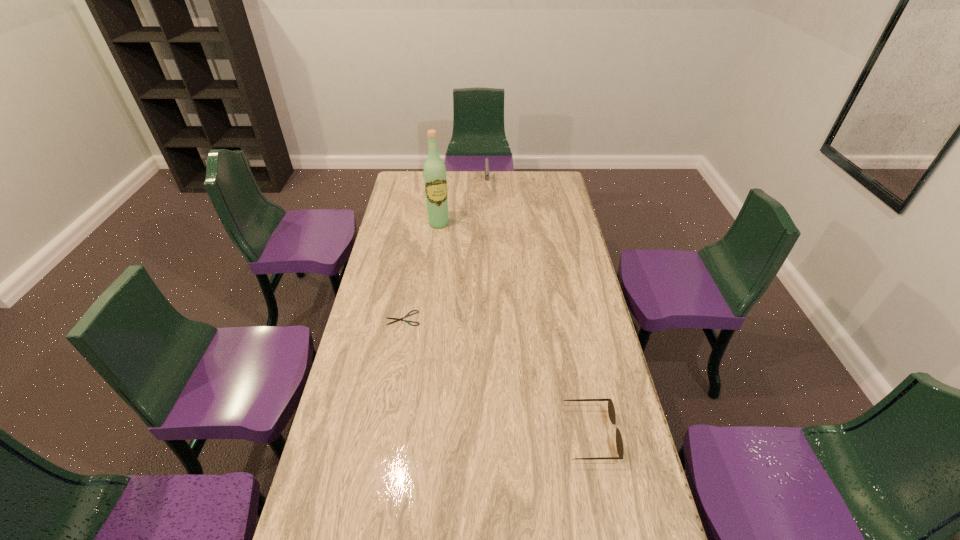
Where is `vacant space at the left edge of the desktop`? vacant space at the left edge of the desktop is located at coordinates (389, 336).

Identify the location of free region at the right edge of the desktop. Image resolution: width=960 pixels, height=540 pixels. (553, 211).

This screenshot has width=960, height=540. What are the coordinates of `free location at the far left corner` in the screenshot? It's located at (408, 186).

Identify the location of vacant space at the far right corner of the desktop. (545, 183).

Locate an element on the screen. free space between the second shortest object and the tallest object is located at coordinates (515, 329).

Locate an element on the screen. The width and height of the screenshot is (960, 540). free space between the third nearest object and the sunglasses is located at coordinates (515, 329).

This screenshot has height=540, width=960. What are the coordinates of `vacant area that lies between the second shortest object and the farthest object` in the screenshot? It's located at (539, 310).

Find the location of `free space between the farthest object and the nearest object`. free space between the farthest object and the nearest object is located at coordinates (539, 310).

Identify the location of free spot between the nearest object and the tallest object. The height and width of the screenshot is (540, 960). (515, 329).

Where is `free space between the second nearest object and the pistol`? The image size is (960, 540). free space between the second nearest object and the pistol is located at coordinates (445, 252).